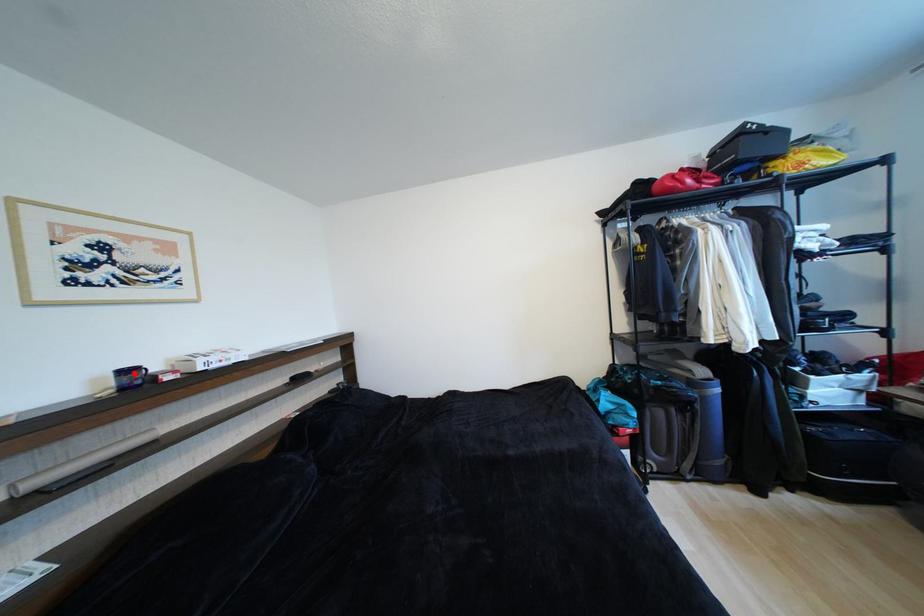
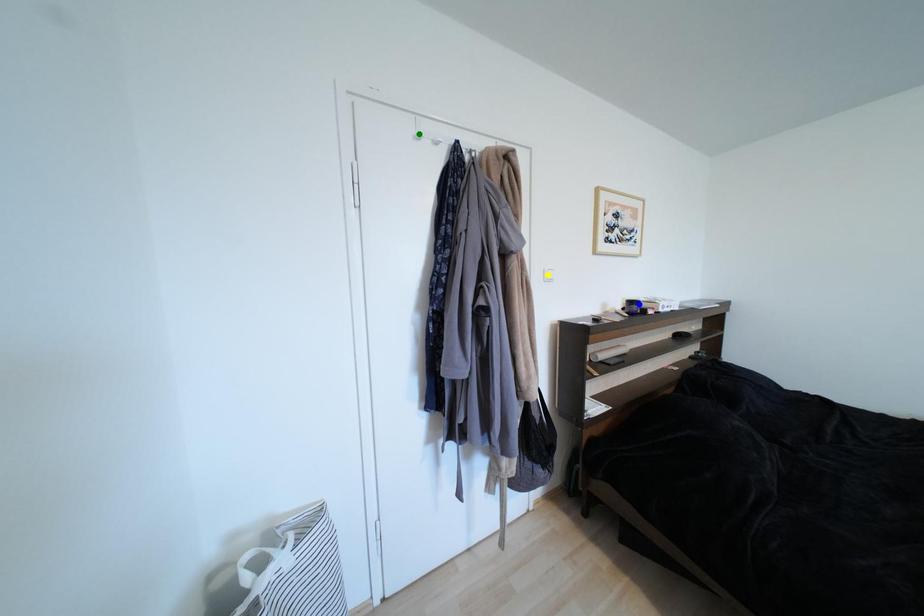
Question: I am providing you with two images of the same scene from different viewpoints. A red point is marked on the first image. You are given multiple points on the second image. Can you choose the point in image 2 that corresponds to the point in image 1?

Choices:
 (A) blue point
 (B) green point
 (C) yellow point

Answer: (A)